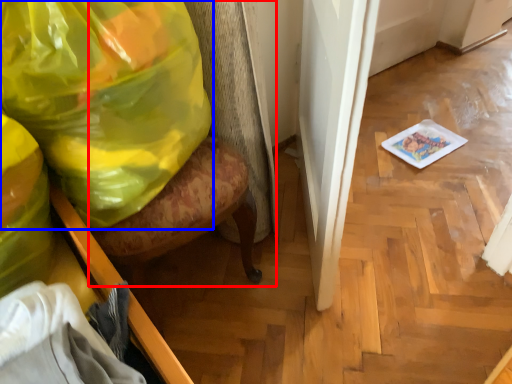
Question: Which object is closer to the camera taking this photo, swivel chair (highlighted by a red box) or plastic bag (highlighted by a blue box)?

Choices:
 (A) swivel chair
 (B) plastic bag

Answer: (A)